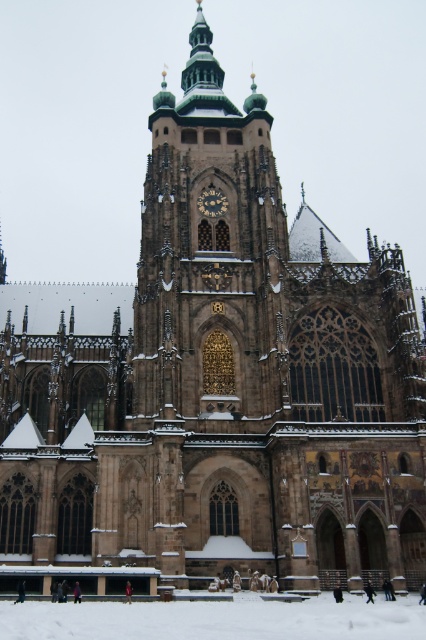
Is brown stone tower at center positioned in front of white powdery snow at lower center?

That is False.

Is brown stone tower at center to the left of white powdery snow at lower center from the viewer's perspective?

Indeed, brown stone tower at center is positioned on the left side of white powdery snow at lower center.

Between point (276, 310) and point (238, 618), which one is positioned behind?

The point (276, 310) is behind.

Identify the location of brown stone tower at center. This screenshot has width=426, height=640. (210, 256).

Does point (232, 228) come farther from viewer compared to point (206, 195)?

That is False.

Between point (238, 115) and point (206, 202), which one is positioned behind?

Point (238, 115)

Who is more distant from viewer, (226,301) or (199,196)?

Point (199,196)

Locate an element on the screen. brown stone tower at center is located at coordinates (210, 256).

Can you confirm if white powdery snow at lower center is positioned to the right of gold metallic clock at center?

Yes, white powdery snow at lower center is to the right of gold metallic clock at center.

Is point (95, 621) behind point (222, 212)?

No, it is in front of (222, 212).

At what (x,y) coordinates should I click in order to perform the action: click on white powdery snow at lower center. Please return your answer as a coordinate pair (x, y). This screenshot has height=640, width=426. Looking at the image, I should click on (216, 620).